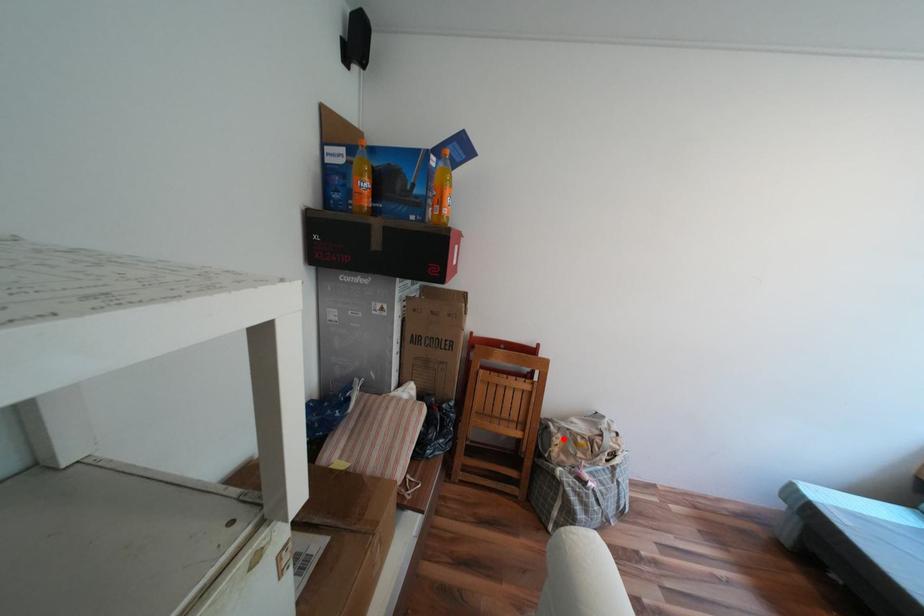
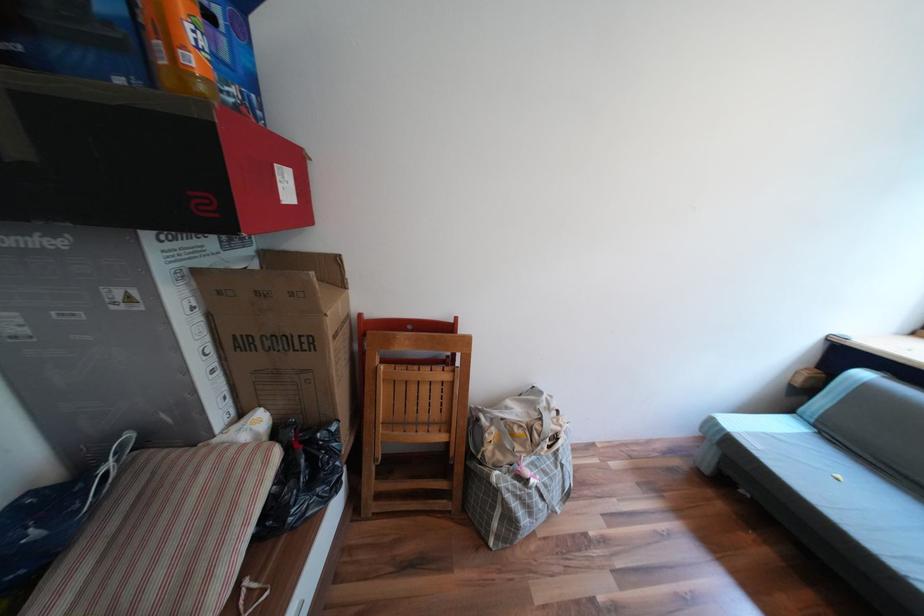
Question: I am providing you with two images of the same scene from different viewpoints. A red point is marked on the first image. Is the red point's position out of view in image 2?

Choices:
 (A) Yes
 (B) No

Answer: (B)